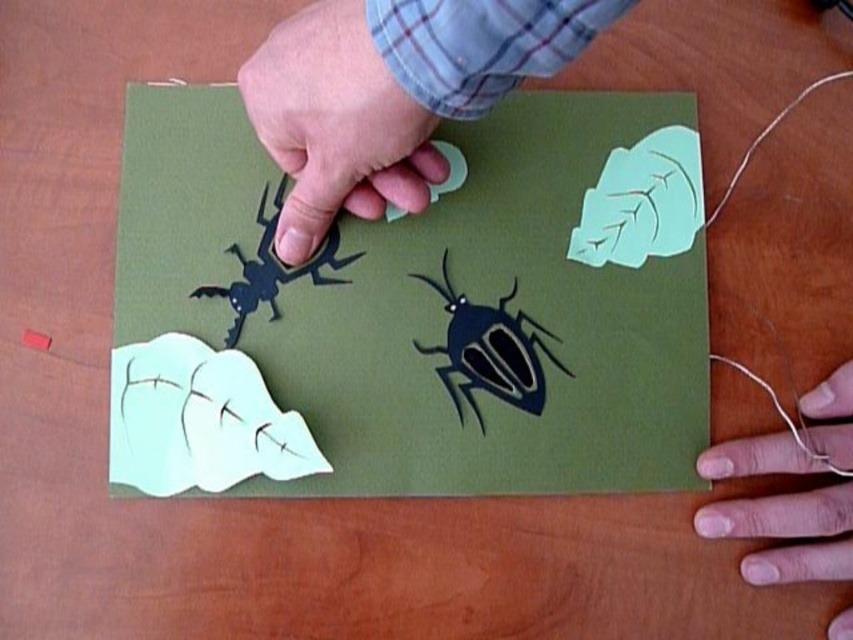
Question: Considering the relative positions of smooth skin hand at lower right and black paper insect at upper left in the image provided, where is smooth skin hand at lower right located with respect to black paper insect at upper left?

Choices:
 (A) below
 (B) above

Answer: (A)

Question: Which is nearer to the matte black beetle at center?

Choices:
 (A) matte green paper at center
 (B) black paper insect at upper left

Answer: (A)

Question: Can you confirm if matte paper hand at upper center is positioned above smooth skin hand at lower right?

Choices:
 (A) yes
 (B) no

Answer: (A)

Question: Which of the following is the farthest from the observer?

Choices:
 (A) (x=697, y=422)
 (B) (x=393, y=170)
 (C) (x=466, y=340)
 (D) (x=326, y=232)

Answer: (A)

Question: Observing the image, what is the correct spatial positioning of matte paper hand at upper center in reference to smooth skin hand at lower right?

Choices:
 (A) right
 (B) left

Answer: (B)

Question: Which of these objects is positioned farthest from the matte green paper at center?

Choices:
 (A) black paper insect at upper left
 (B) smooth skin hand at lower right
 (C) matte black beetle at center
 (D) matte paper hand at upper center

Answer: (B)